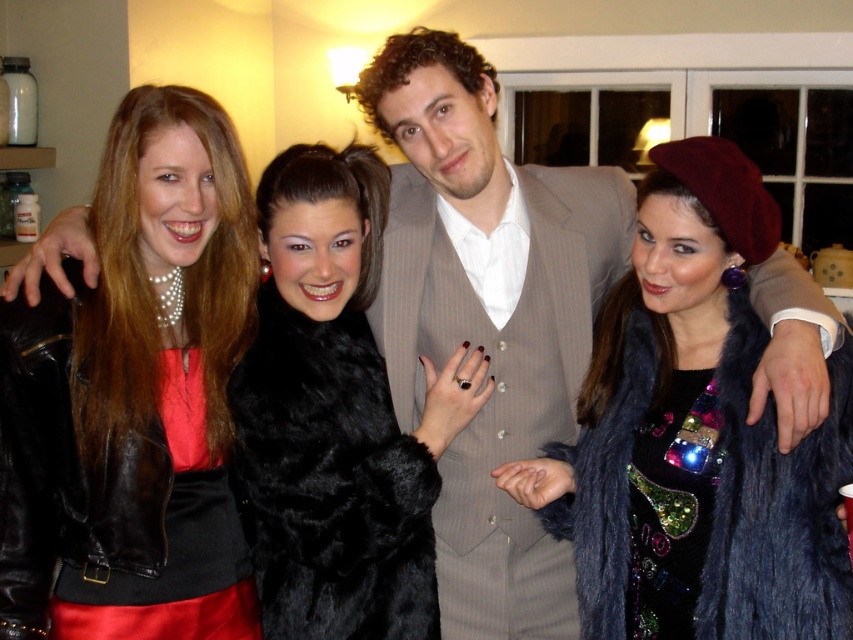
Between fuzzy dark blue fur coat at center and black fur coat at center, which one is positioned lower?

fuzzy dark blue fur coat at center is lower down.

Is fuzzy dark blue fur coat at center above black fur coat at center?

Actually, fuzzy dark blue fur coat at center is below black fur coat at center.

Is point (698, 212) positioned in front of point (273, 312)?

Yes, point (698, 212) is closer to viewer.

Find the location of `fuzzy dark blue fur coat at center`. fuzzy dark blue fur coat at center is located at coordinates [699, 422].

Does shiny black leather jacket at left appear on the right side of black fur coat at center?

Incorrect, shiny black leather jacket at left is not on the right side of black fur coat at center.

How much distance is there between shiny black leather jacket at left and black fur coat at center?

7.70 inches

In order to click on shiny black leather jacket at left in this screenshot , I will do `click(134, 394)`.

Image resolution: width=853 pixels, height=640 pixels. I want to click on shiny black leather jacket at left, so click(x=134, y=394).

Between shiny black leather jacket at left and fuzzy dark blue fur coat at center, which one has more height?

shiny black leather jacket at left

Is shiny black leather jacket at left above fuzzy dark blue fur coat at center?

Correct, shiny black leather jacket at left is located above fuzzy dark blue fur coat at center.

Which is in front, point (227, 173) or point (689, 282)?

Positioned in front is point (689, 282).

I want to click on shiny black leather jacket at left, so click(x=134, y=394).